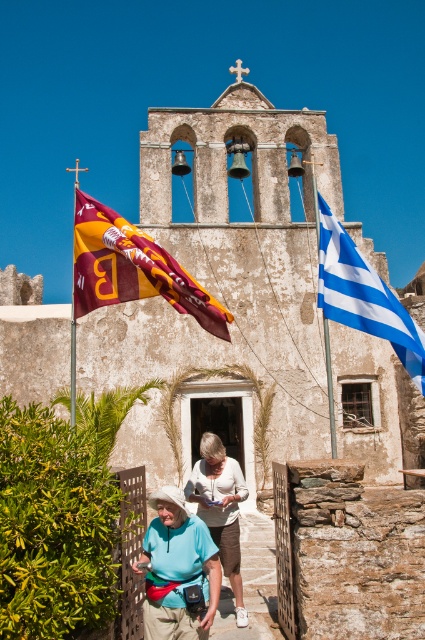
Question: Which point appears farthest from the camera in this image?

Choices:
 (A) (138, 237)
 (B) (226, 525)
 (C) (326, 314)

Answer: (B)

Question: Which object appears closest to the camera in this image?

Choices:
 (A) blue/white striped flag at right
 (B) maroon fabric flag at left
 (C) light blue fabric at center

Answer: (C)

Question: Which of the following is the farthest from the observer?

Choices:
 (A) (424, 380)
 (B) (127, 276)

Answer: (B)

Question: Does maroon fabric flag at left lie in front of light blue fabric at center?

Choices:
 (A) yes
 (B) no

Answer: (B)

Question: Does maroon fabric flag at left appear under light blue fabric at center?

Choices:
 (A) yes
 (B) no

Answer: (B)

Question: Is light blue fabric at center wider than blue/white striped flag at right?

Choices:
 (A) no
 (B) yes

Answer: (B)